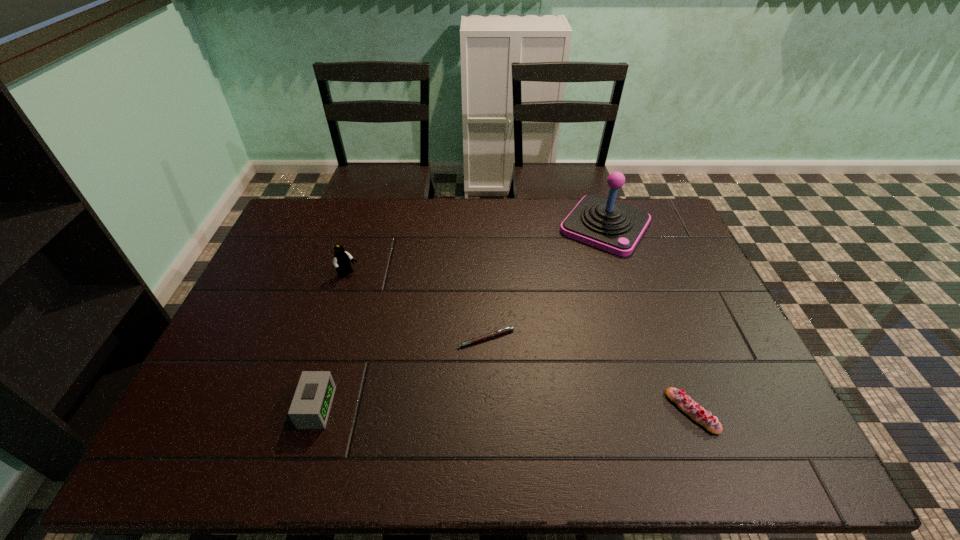
At what (x,y) coordinates should I click in order to perform the action: click on alarm clock positioned at the near edge. Please return your answer as a coordinate pair (x, y). Image resolution: width=960 pixels, height=540 pixels. Looking at the image, I should click on (311, 404).

Locate an element on the screen. The height and width of the screenshot is (540, 960). eclair at the near edge is located at coordinates (696, 412).

The width and height of the screenshot is (960, 540). Identify the location of eclair situated at the right edge. (696, 412).

Image resolution: width=960 pixels, height=540 pixels. I want to click on joystick that is at the right edge, so click(603, 223).

Where is `object that is at the far right corner`? The height and width of the screenshot is (540, 960). object that is at the far right corner is located at coordinates [603, 223].

Identify the location of object that is at the near right corner. (696, 412).

You are a GUI agent. You are given a task and a screenshot of the screen. Output one action in this format:
    pyautogui.click(x=<x>, y=<y>)
    Task: Click on the vacant space at the far edge of the desktop
    This screenshot has width=960, height=540.
    Given the screenshot: What is the action you would take?
    pyautogui.click(x=415, y=217)

This screenshot has width=960, height=540. I want to click on vacant space at the left edge of the desktop, so click(252, 292).

In the image, there is a desktop. Find the location of `vacant space at the right edge`. vacant space at the right edge is located at coordinates (656, 266).

In the image, there is a desktop. Where is `vacant region at the far left corner`? vacant region at the far left corner is located at coordinates (311, 200).